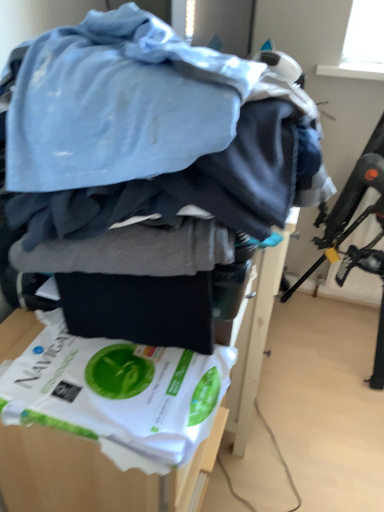
Locate an element on the screen. free location in front of black plastic swivel chair at upper right is located at coordinates (319, 424).